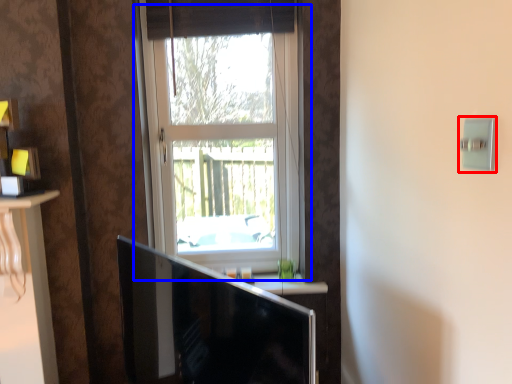
Question: Which object is closer to the camera taking this photo, light switch (highlighted by a red box) or window (highlighted by a blue box)?

Choices:
 (A) light switch
 (B) window

Answer: (A)